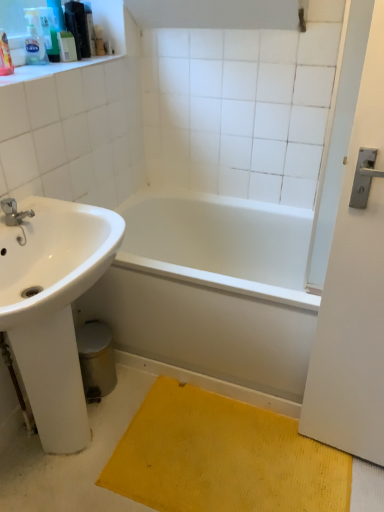
Question: Is translucent plastic soap dispenser at upper left, which is counted as the 3th toiletry, starting from the right, located outside translucent plastic soap dispenser at upper left, the second toiletry viewed from the right?

Choices:
 (A) no
 (B) yes

Answer: (B)

Question: Is translucent plastic soap dispenser at upper left, which is counted as the 2th toiletry, starting from the left, at the back of translucent plastic soap dispenser at upper left, which is counted as the 3th toiletry, starting from the right?

Choices:
 (A) yes
 (B) no

Answer: (B)

Question: From a real-world perspective, is translucent plastic soap dispenser at upper left, arranged as the 1th toiletry when viewed from the left, located higher than translucent plastic soap dispenser at upper left, which is counted as the 2th toiletry, starting from the left?

Choices:
 (A) yes
 (B) no

Answer: (B)

Question: Does translucent plastic soap dispenser at upper left, which is counted as the 3th toiletry, starting from the right, have a greater height compared to translucent plastic soap dispenser at upper left, which is counted as the 2th toiletry, starting from the left?

Choices:
 (A) no
 (B) yes

Answer: (A)

Question: From a real-world perspective, is translucent plastic soap dispenser at upper left, arranged as the 1th toiletry when viewed from the left, positioned under translucent plastic soap dispenser at upper left, which is counted as the 2th toiletry, starting from the left, based on gravity?

Choices:
 (A) yes
 (B) no

Answer: (A)

Question: Considering the positions of translucent plastic soap dispenser at upper left, arranged as the 1th toiletry when viewed from the left, and yellow textured mat at lower right in the image, is translucent plastic soap dispenser at upper left, arranged as the 1th toiletry when viewed from the left, taller or shorter than yellow textured mat at lower right?

Choices:
 (A) short
 (B) tall

Answer: (B)

Question: From a real-world perspective, is translucent plastic soap dispenser at upper left, which is counted as the 3th toiletry, starting from the right, above or below yellow textured mat at lower right?

Choices:
 (A) below
 (B) above

Answer: (B)

Question: Considering their positions, is translucent plastic soap dispenser at upper left, which is counted as the 3th toiletry, starting from the right, located in front of or behind yellow textured mat at lower right?

Choices:
 (A) behind
 (B) front

Answer: (A)

Question: Based on their positions, is translucent plastic soap dispenser at upper left, arranged as the 1th toiletry when viewed from the left, located to the left or right of yellow textured mat at lower right?

Choices:
 (A) left
 (B) right

Answer: (A)

Question: Is brushed metal faucet at left to the left or to the right of translucent plastic soap dispenser at upper left, arranged as the 1th toiletry when viewed from the left, in the image?

Choices:
 (A) right
 (B) left

Answer: (A)

Question: From a real-world perspective, is brushed metal faucet at left above or below translucent plastic soap dispenser at upper left, which is counted as the 3th toiletry, starting from the right?

Choices:
 (A) above
 (B) below

Answer: (B)

Question: Is point (14, 223) positioned closer to the camera than point (28, 64)?

Choices:
 (A) closer
 (B) farther

Answer: (A)

Question: Looking at their shapes, would you say brushed metal faucet at left is wider or thinner than translucent plastic soap dispenser at upper left, which is counted as the 3th toiletry, starting from the right?

Choices:
 (A) wide
 (B) thin

Answer: (A)

Question: Do you think white plastic container at upper left, the first toiletry when ordered from right to left, is within translucent plastic soap dispenser at upper left, which is counted as the 2th toiletry, starting from the left, or outside of it?

Choices:
 (A) inside
 (B) outside

Answer: (B)

Question: From a real-world perspective, is white plastic container at upper left, which appears as the third toiletry when viewed from the left, positioned above or below translucent plastic soap dispenser at upper left, which is counted as the 2th toiletry, starting from the left?

Choices:
 (A) below
 (B) above

Answer: (A)